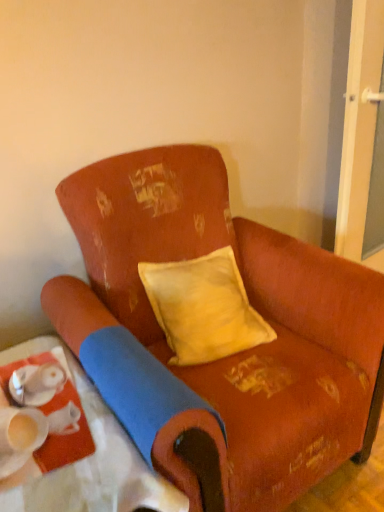
Question: Can you confirm if matte white tray at lower left is thinner than transparent glass screen door at right?

Choices:
 (A) no
 (B) yes

Answer: (A)

Question: Does matte white tray at lower left have a lesser height compared to transparent glass screen door at right?

Choices:
 (A) yes
 (B) no

Answer: (A)

Question: Is matte white tray at lower left not close to transparent glass screen door at right?

Choices:
 (A) yes
 (B) no

Answer: (A)

Question: From the image's perspective, is matte white tray at lower left on transparent glass screen door at right?

Choices:
 (A) no
 (B) yes

Answer: (A)

Question: Does matte white tray at lower left appear on the left side of transparent glass screen door at right?

Choices:
 (A) no
 (B) yes

Answer: (B)

Question: Does matte white tray at lower left have a smaller size compared to transparent glass screen door at right?

Choices:
 (A) no
 (B) yes

Answer: (A)

Question: From the image's perspective, is yellow velvet pillow at center located beneath worn fabric chair at center?

Choices:
 (A) yes
 (B) no

Answer: (B)

Question: Can you confirm if yellow velvet pillow at center is smaller than worn fabric chair at center?

Choices:
 (A) no
 (B) yes

Answer: (B)

Question: Is yellow velvet pillow at center located outside worn fabric chair at center?

Choices:
 (A) yes
 (B) no

Answer: (B)

Question: Does yellow velvet pillow at center have a greater height compared to worn fabric chair at center?

Choices:
 (A) no
 (B) yes

Answer: (A)

Question: Would you say yellow velvet pillow at center contains worn fabric chair at center?

Choices:
 (A) no
 (B) yes

Answer: (A)

Question: From the image's perspective, is yellow velvet pillow at center over worn fabric chair at center?

Choices:
 (A) yes
 (B) no

Answer: (A)

Question: Is matte white tray at lower left behind worn fabric chair at center?

Choices:
 (A) yes
 (B) no

Answer: (A)